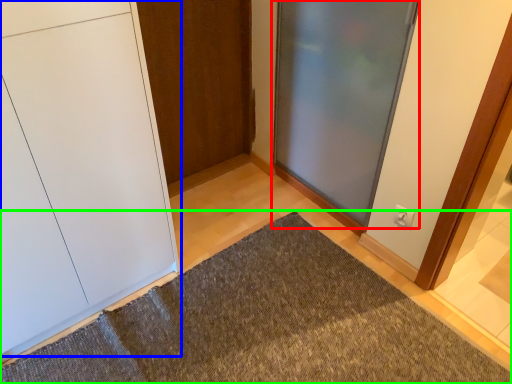
Question: Which object is positioned closest to door (highlighted by a red box)? Select from door (highlighted by a blue box) and doormat (highlighted by a green box).

Choices:
 (A) door
 (B) doormat

Answer: (B)